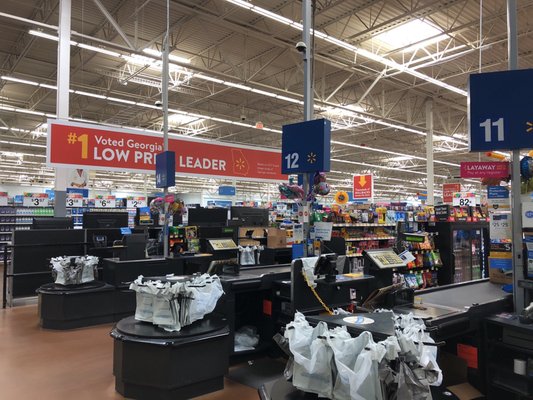
Locate an element on the screen. register is located at coordinates (394, 264).